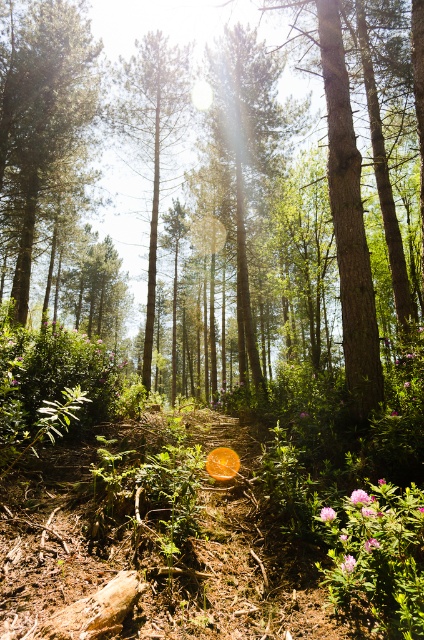
Is green leafy tree at center positioned before smooth brown tree trunk at center?

Yes, it is.

Image resolution: width=424 pixels, height=640 pixels. What do you see at coordinates (245, 156) in the screenshot?
I see `green leafy tree at center` at bounding box center [245, 156].

The width and height of the screenshot is (424, 640). What are the coordinates of `green leafy tree at center` in the screenshot? It's located at (245, 156).

Can you confirm if green matte tree at center is wider than green leafy tree at center?

Yes, green matte tree at center is wider than green leafy tree at center.

Who is lower down, green matte tree at center or green leafy tree at center?

green leafy tree at center

Locate an element on the screen. green matte tree at center is located at coordinates (42, 125).

Between point (63, 221) and point (150, 54), which one is positioned behind?

The point (63, 221) is more distant.

From the picture: Does green matte tree at center have a smaller size compared to smooth brown tree trunk at center?

No, green matte tree at center is not smaller than smooth brown tree trunk at center.

Is point (13, 205) positioned after point (150, 333)?

That is False.

The height and width of the screenshot is (640, 424). Identify the location of green matte tree at center. (42, 125).